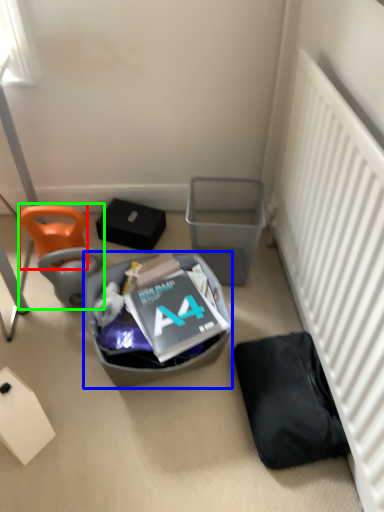
Question: Which object is positioned closest to bean bag chair (highlighted by a red box)? Select from trash bin/can (highlighted by a blue box) and bean bag chair (highlighted by a green box).

Choices:
 (A) trash bin/can
 (B) bean bag chair

Answer: (B)